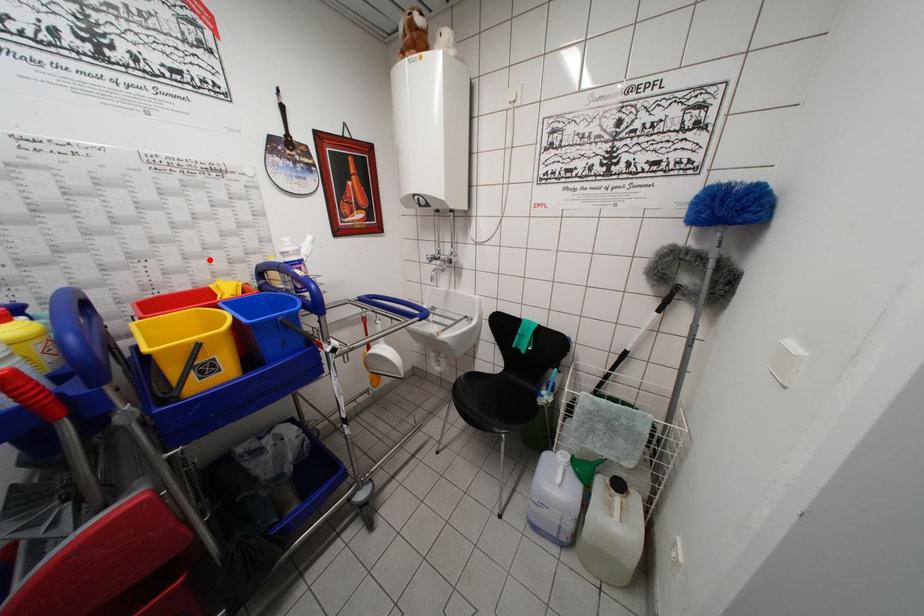
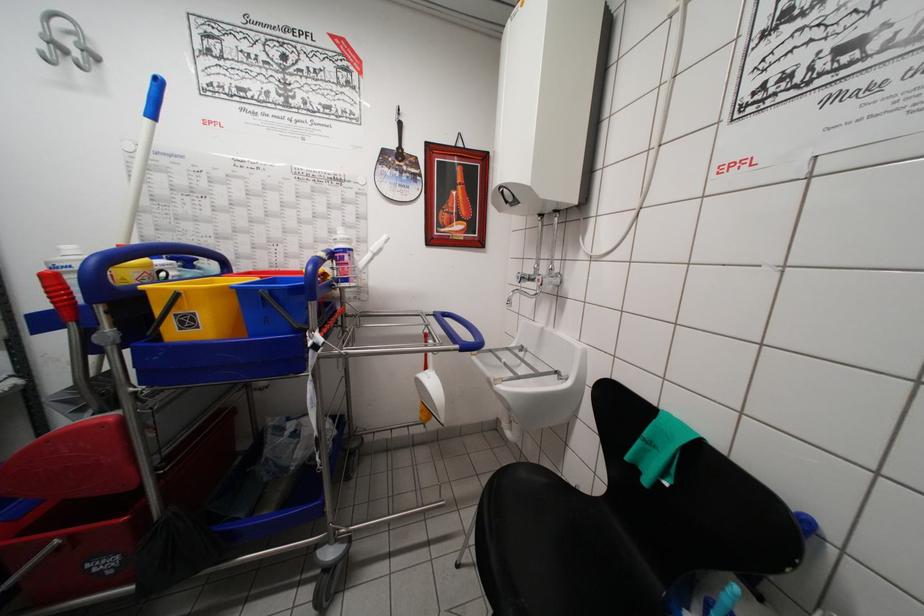
The point at the highlighted location is marked in the first image. Where is the corresponding point in the second image?

(319, 252)